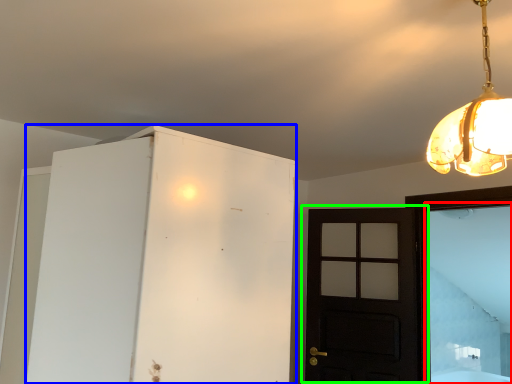
Question: Estimate the real-world distances between objects in this image. Which object is closer to window (highlighted by a red box), cabinetry (highlighted by a blue box) or door (highlighted by a green box)?

Choices:
 (A) cabinetry
 (B) door

Answer: (B)